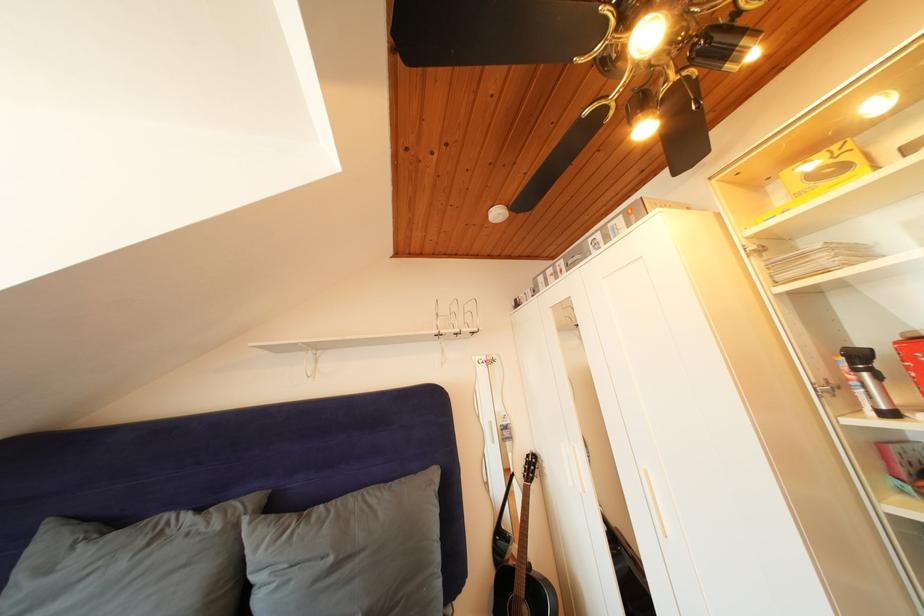
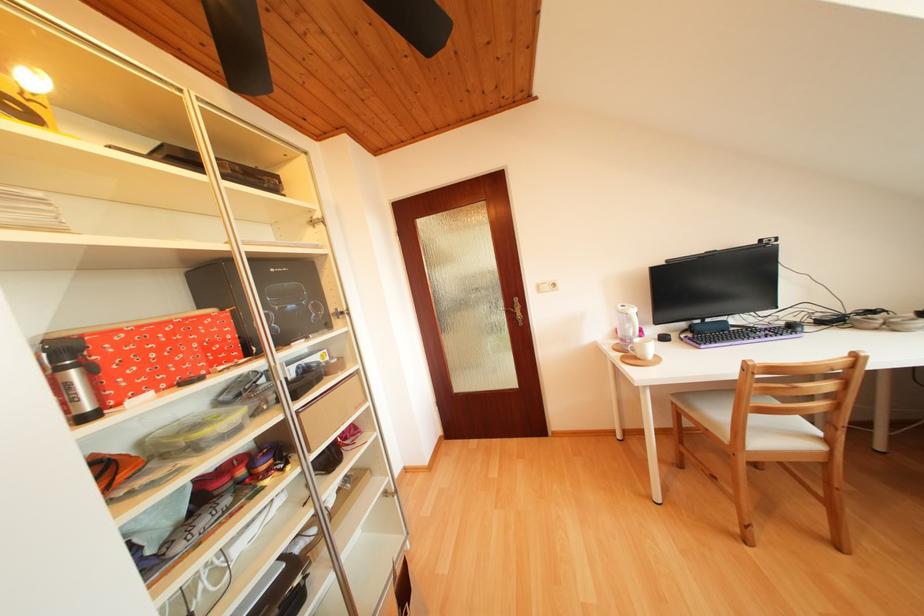
Where in the second image is the point corresponding to (x=892, y=411) from the first image?

(96, 414)